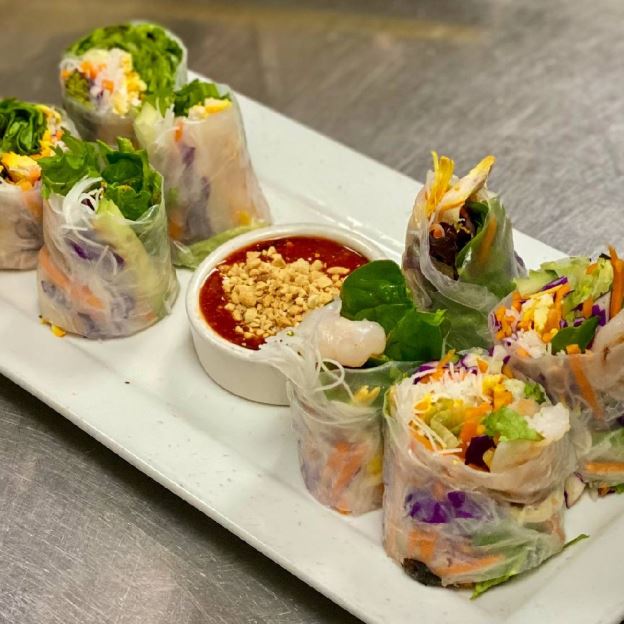
You are a GUI agent. You are given a task and a screenshot of the screen. Output one action in this format:
    pyautogui.click(x=<x>, y=<y>)
    Task: Click on the white bowl
    The height and width of the screenshot is (624, 624).
    Given the screenshot: What is the action you would take?
    pyautogui.click(x=230, y=358)